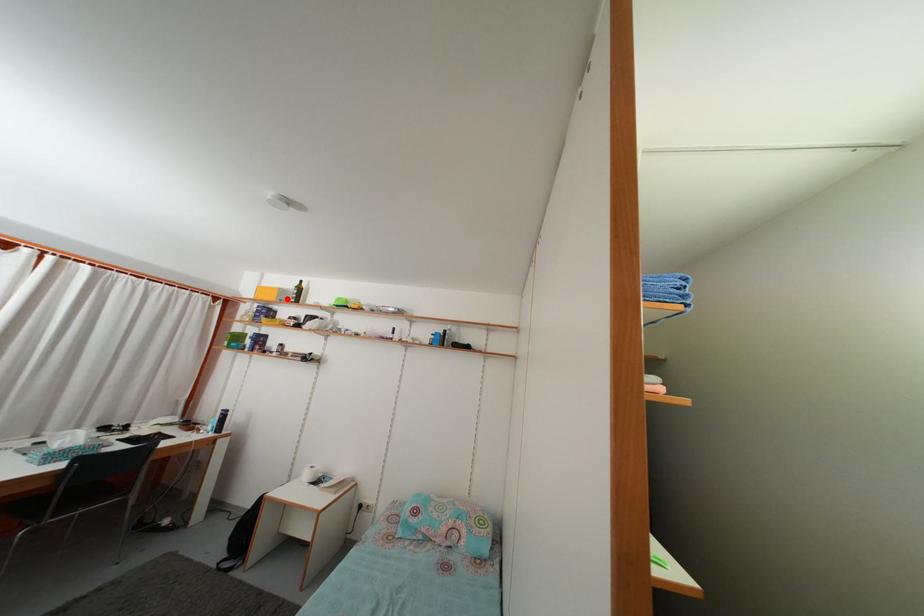
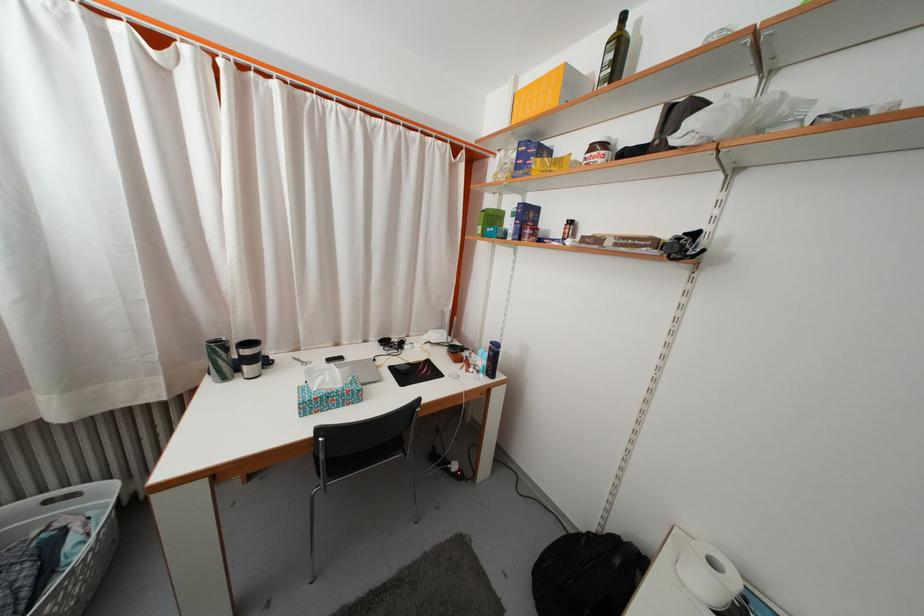
The point at the highlighted location is marked in the first image. Where is the corresponding point in the second image?

(575, 84)